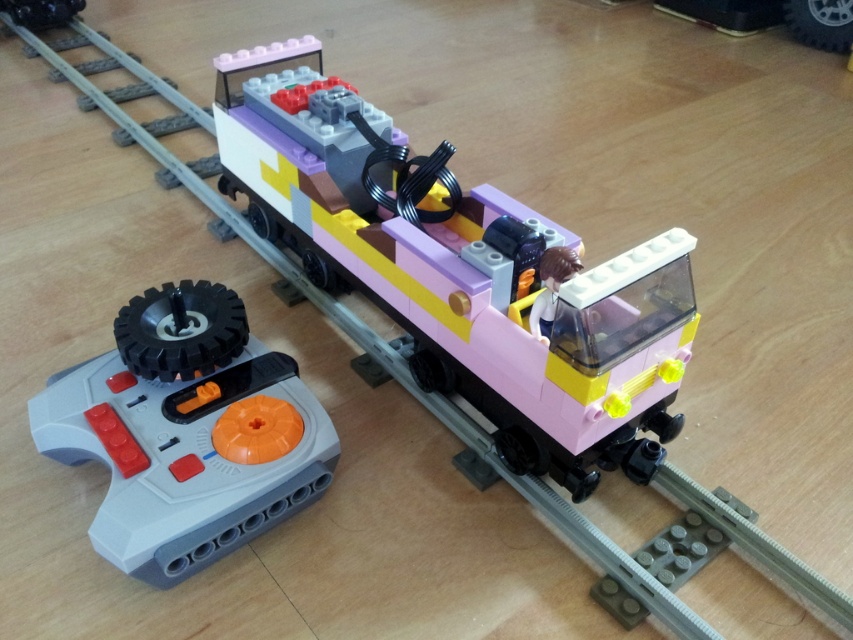
Question: Among these objects, which one is farthest from the camera?

Choices:
 (A) gray plastic remote control at lower left
 (B) pastel pink plastic train car at center
 (C) metallic black remote control at upper left

Answer: (C)

Question: Can you confirm if gray plastic remote control at lower left is positioned below metallic black remote control at upper left?

Choices:
 (A) yes
 (B) no

Answer: (A)

Question: Which object is closer to the camera taking this photo?

Choices:
 (A) gray plastic remote control at lower left
 (B) pastel pink plastic train car at center

Answer: (B)

Question: Is pastel pink plastic train car at center to the right of gray plastic remote control at lower left from the viewer's perspective?

Choices:
 (A) yes
 (B) no

Answer: (A)

Question: Does pastel pink plastic train car at center appear on the right side of metallic black remote control at upper left?

Choices:
 (A) yes
 (B) no

Answer: (A)

Question: Among these points, which one is nearest to the camera?

Choices:
 (A) (177, 566)
 (B) (630, 396)

Answer: (A)